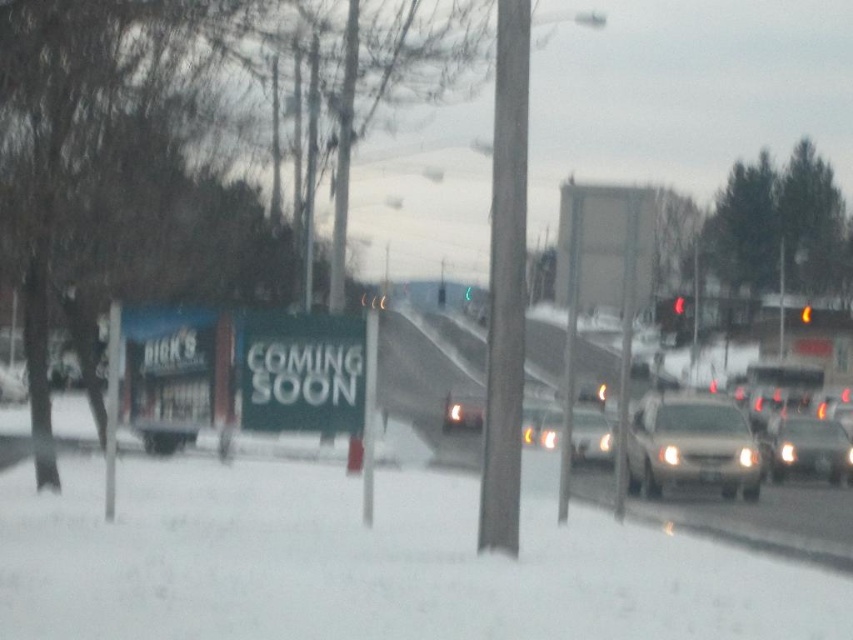
You are a delivery driver needing to park your 1.8 meters wide van next to the metallic silver sedan at center and the red glass traffic light at upper center. Which object should you avoid to ensure your van fits without touching anything?

You should avoid the red glass traffic light at upper center because the metallic silver sedan at center is wider than the red glass traffic light at upper center, so the space next to the traffic light is narrower and might not accommodate the van.

You are a delivery driver who needs to park your matte silver sedan at right in a nearby parking spot. The parking spot is 3 meters away from the camera. Can your car fit into the parking spot?

The matte silver sedan at right is 33.56 meters away from the camera, which is much farther than the 3 meters required for the parking spot. Therefore, the car cannot fit into the parking spot because it is too far away.

You are driving a car that is 1.8 meters wide. You need to pass through a narrow alley between the matte silver sedan at right and the red glass traffic light at upper right. Can your car fit through the space between them?

The matte silver sedan at right is wider than the red glass traffic light at upper right, so the space between them may not be wide enough for your car that is 1.8 meters wide. You should check the exact width before proceeding.